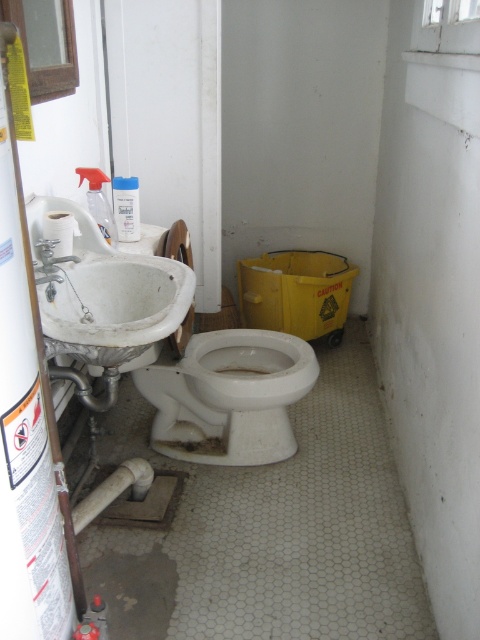
Who is positioned more to the left, white matte toilet at center or white matte sink at left?

white matte sink at left

Which is in front, point (180, 435) or point (87, 337)?

Positioned in front is point (87, 337).

The width and height of the screenshot is (480, 640). In order to click on white matte toilet at center in this screenshot , I will do `click(228, 396)`.